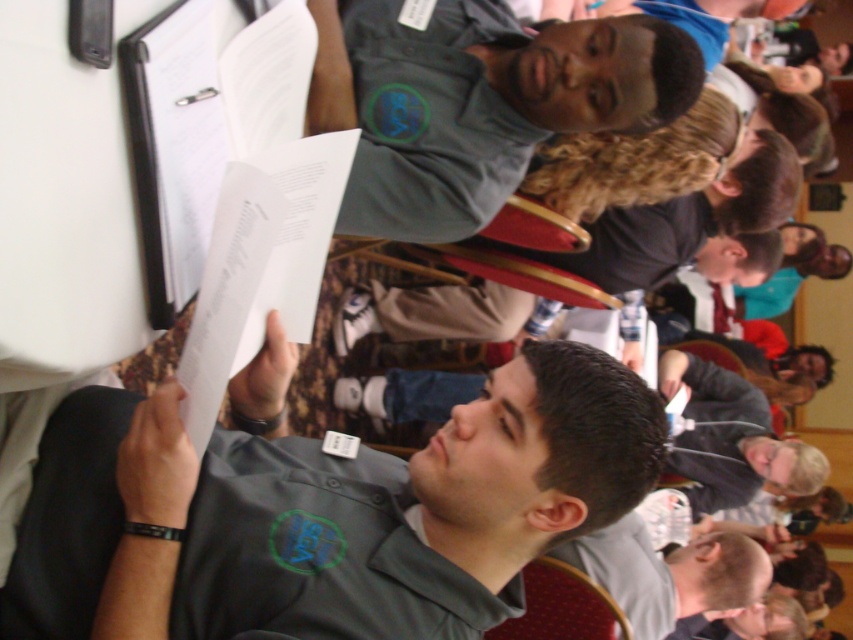
You are organizing a photo shoot and need to place a backdrop that must be wider than the widest object in the scene. Which object between the dark gray shirt at upper center and the gray fleece jacket at lower right should you measure to ensure the backdrop is wide enough?

The dark gray shirt at upper center is wider than the gray fleece jacket at lower right, so you should measure the dark gray shirt at upper center to ensure the backdrop is wide enough.